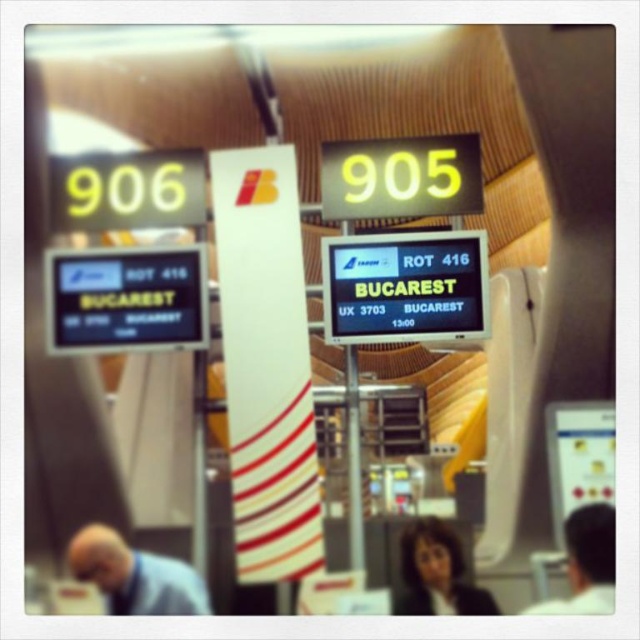
Question: Which of the following is the farthest from the observer?

Choices:
 (A) yellow digital display at center
 (B) dark brown hair at center

Answer: (A)

Question: Where is black lcd screen at center located in relation to dark hair at right in the image?

Choices:
 (A) right
 (B) left

Answer: (B)

Question: Which point is farther from the camera taking this photo?

Choices:
 (A) (349, 161)
 (B) (595, 541)
 (C) (464, 588)

Answer: (A)

Question: Which object is positioned farthest from the dark hair at right?

Choices:
 (A) yellow digital sign at center
 (B) yellow digital display at center
 (C) dark brown hair at center
 (D) yellow digital sign at upper left

Answer: (D)

Question: Can you confirm if yellow digital sign at upper left is positioned to the left of dark brown hair at center?

Choices:
 (A) yes
 (B) no

Answer: (A)

Question: Is yellow digital display at center wider than dark brown hair at center?

Choices:
 (A) yes
 (B) no

Answer: (A)